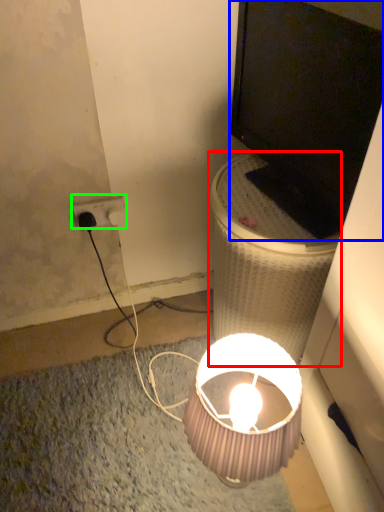
Question: Which object is positioned farthest from table (highlighted by a red box)? Select from television (highlighted by a blue box) and power outlet (highlighted by a green box).

Choices:
 (A) television
 (B) power outlet

Answer: (B)